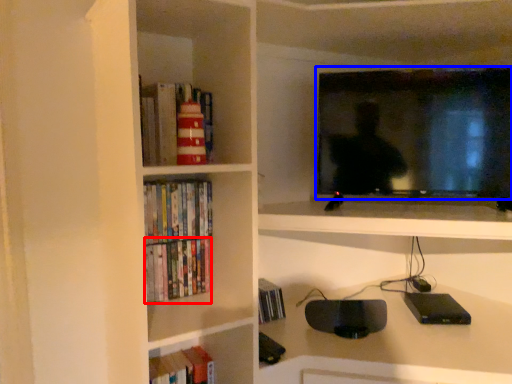
Question: Which of the following is the farthest to the observer, book (highlighted by a red box) or television (highlighted by a blue box)?

Choices:
 (A) book
 (B) television

Answer: (A)